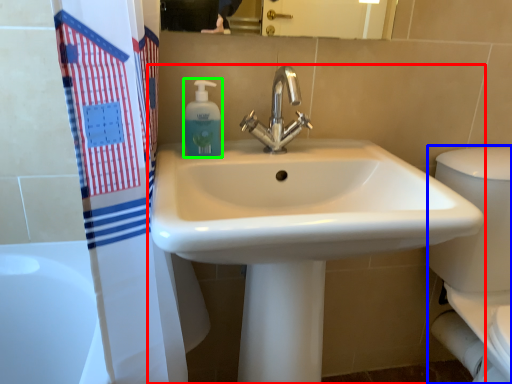
Question: Which object is positioned closest to sink (highlighted by a red box)? Select from porcelain (highlighted by a blue box) and soap dispenser (highlighted by a green box).

Choices:
 (A) porcelain
 (B) soap dispenser

Answer: (B)